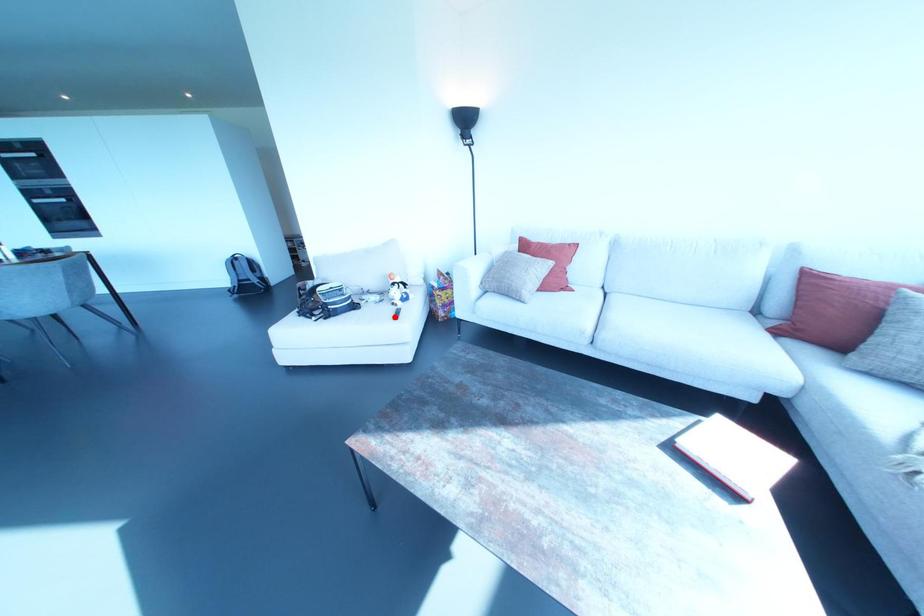
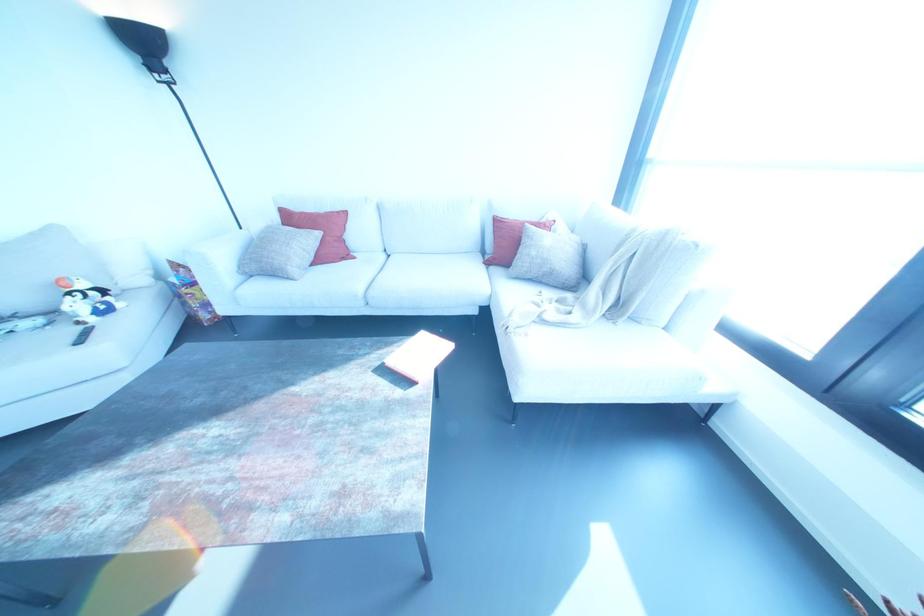
The point at the highlighted location is marked in the first image. Where is the corresponding point in the second image?

(78, 341)